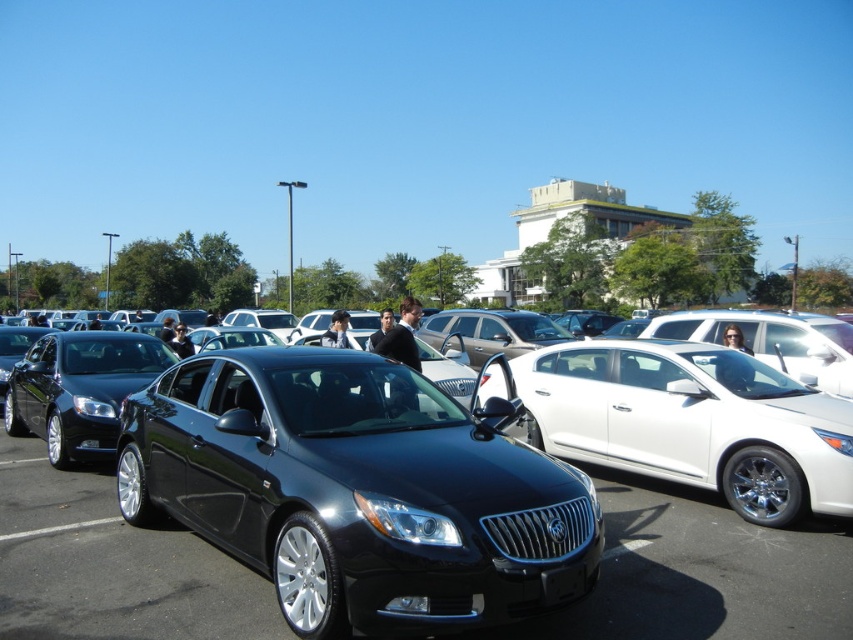
You are standing in the parking lot and want to approach the glossy black car at center and the glossy black sedan at center. Which one should you walk towards first if you want to reach the one closer to you?

You should walk towards the glossy black car at center first because it is closer to you than the glossy black sedan at center.

You are a parking attendant at a dealership. You need to park a new white glossy sedan at center and a glossy black sedan at center in adjacent spaces. Given the spaces are all the same size, which car will require a larger parking space?

The glossy black sedan at center requires a larger parking space because its width is greater than the white glossy sedan at center.